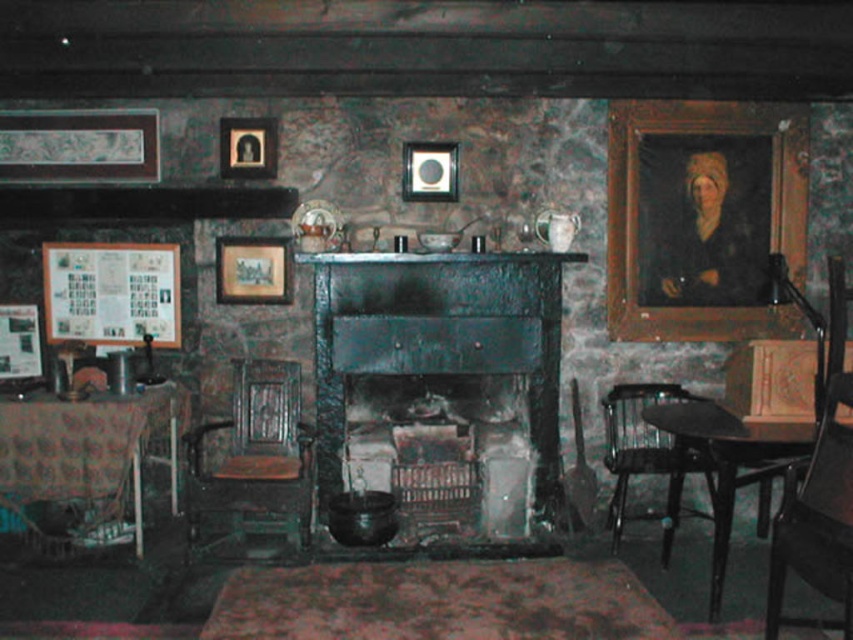
Can you confirm if dark wood fireplace at center is bigger than wooden plaque at left?

Indeed, dark wood fireplace at center has a larger size compared to wooden plaque at left.

Between dark wood fireplace at center and wooden plaque at left, which one has more height?

dark wood fireplace at center

Locate an element on the screen. dark wood fireplace at center is located at coordinates (440, 394).

The image size is (853, 640). I want to click on dark wood fireplace at center, so click(x=440, y=394).

Is wooden chair at right thinner than black wood armchair at lower right?

Yes, wooden chair at right is thinner than black wood armchair at lower right.

Does point (815, 522) come in front of point (654, 404)?

Yes, point (815, 522) is in front of point (654, 404).

Locate an element on the screen. wooden chair at right is located at coordinates pos(817,520).

Is wooden polished rocking chair at center-left below matte paper picture frame at left?

Indeed, wooden polished rocking chair at center-left is positioned under matte paper picture frame at left.

Between wooden polished rocking chair at center-left and matte paper picture frame at left, which one has more height?

Standing taller between the two is wooden polished rocking chair at center-left.

Where is `wooden polished rocking chair at center-left`? The height and width of the screenshot is (640, 853). wooden polished rocking chair at center-left is located at coordinates (254, 465).

Locate an element on the screen. The height and width of the screenshot is (640, 853). wooden polished rocking chair at center-left is located at coordinates (254, 465).